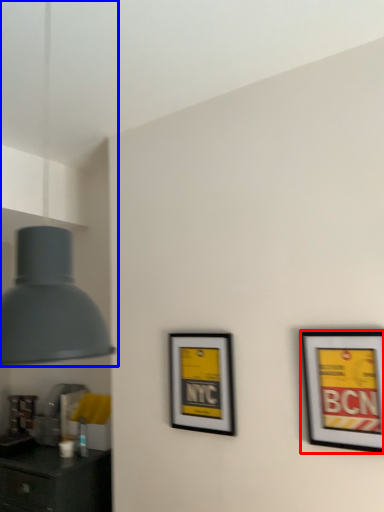
Question: Which of the following is the closest to the observer, picture frame (highlighted by a red box) or lamp (highlighted by a blue box)?

Choices:
 (A) picture frame
 (B) lamp

Answer: (B)